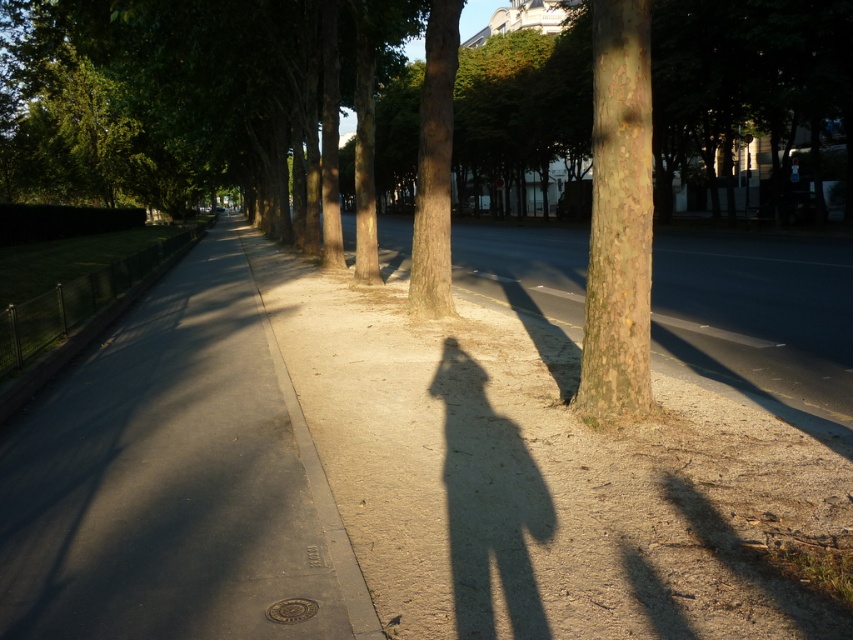
You are a gardener who needs to plant a new tree trunk in the dirt sidewalk at center. Based on the scene, can the brown rough tree trunk at center fit into the brown dirt sidewalk at center without needing to widen the sidewalk?

The brown dirt sidewalk at center is wider than the brown rough tree trunk at center, so the tree trunk can fit without needing to widen the sidewalk.

You are a delivery person with a bike that can only ride on surfaces wider than 1 meter. You need to go from the metal fence on the left to the dirt patch on the right. Can you ride your bike directly over the dark asphalt pavement at center and the smooth brown bark at center? Explain why.

The dark asphalt pavement at center is larger in size than smooth brown bark at center. Since the bike requires a surface wider than 1 meter, you can ride over the dark asphalt pavement at center but not the smooth brown bark at center, as the latter is smaller and likely narrower than the required width.

You are a gardener who needs to water the brown dirt sidewalk at center and the smooth brown bark at center. Your watering can has a maximum range of 20 feet. Without moving closer, can you water both areas from your current position?

The distance between the brown dirt sidewalk at center and the smooth brown bark at center is 23.43 feet, which exceeds the watering can range of 20 feet. Therefore, you cannot water both areas without moving closer.